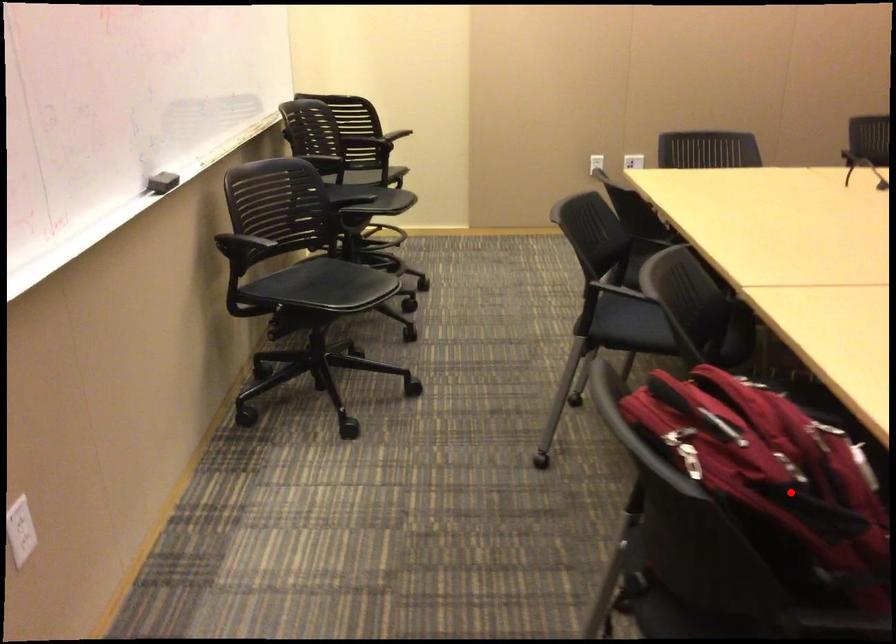
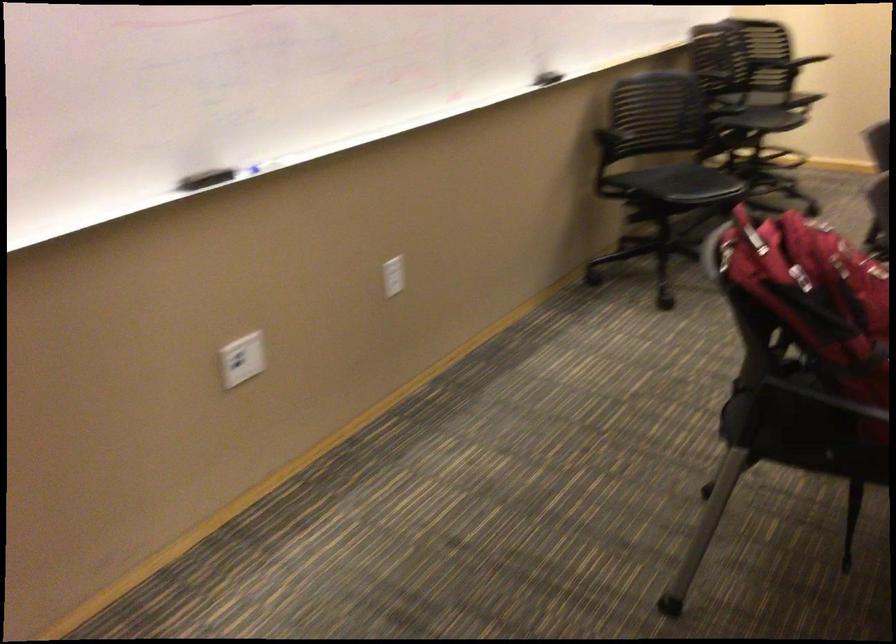
Locate, in the second image, the point that corresponds to the highlighted location in the first image.

(815, 295)